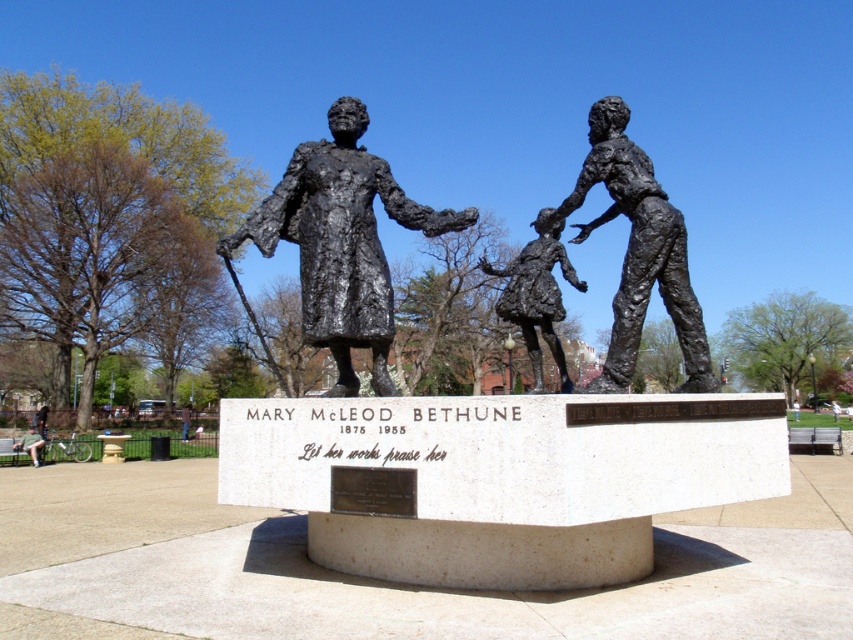
I want to click on bronze statue at center, so click(341, 243).

Which is above, bronze statue at center or green fabric bench at lower left?

Positioned higher is bronze statue at center.

Image resolution: width=853 pixels, height=640 pixels. What do you see at coordinates (341, 243) in the screenshot?
I see `bronze statue at center` at bounding box center [341, 243].

The image size is (853, 640). What are the coordinates of `bronze statue at center` in the screenshot? It's located at (341, 243).

Can you confirm if green fabric bench at lower left is thinner than brown leather jacket at center?

Incorrect, green fabric bench at lower left's width is not less than brown leather jacket at center's.

Does green fabric bench at lower left appear on the left side of brown leather jacket at center?

Indeed, green fabric bench at lower left is positioned on the left side of brown leather jacket at center.

What do you see at coordinates (30, 444) in the screenshot?
I see `green fabric bench at lower left` at bounding box center [30, 444].

Locate an element on the screen. green fabric bench at lower left is located at coordinates (30, 444).

Does bronze statue of child at right appear over green fabric bench at lower left?

Correct, bronze statue of child at right is located above green fabric bench at lower left.

Is bronze statue of child at right taller than green fabric bench at lower left?

Correct, bronze statue of child at right is much taller as green fabric bench at lower left.

Is point (618, 131) positioned after point (15, 449)?

That is False.

You are a GUI agent. You are given a task and a screenshot of the screen. Output one action in this format:
    pyautogui.click(x=<x>, y=<y>)
    Task: Click on the bronze statue of child at right
    Image resolution: width=853 pixels, height=640 pixels.
    Given the screenshot: What is the action you would take?
    coord(639,252)